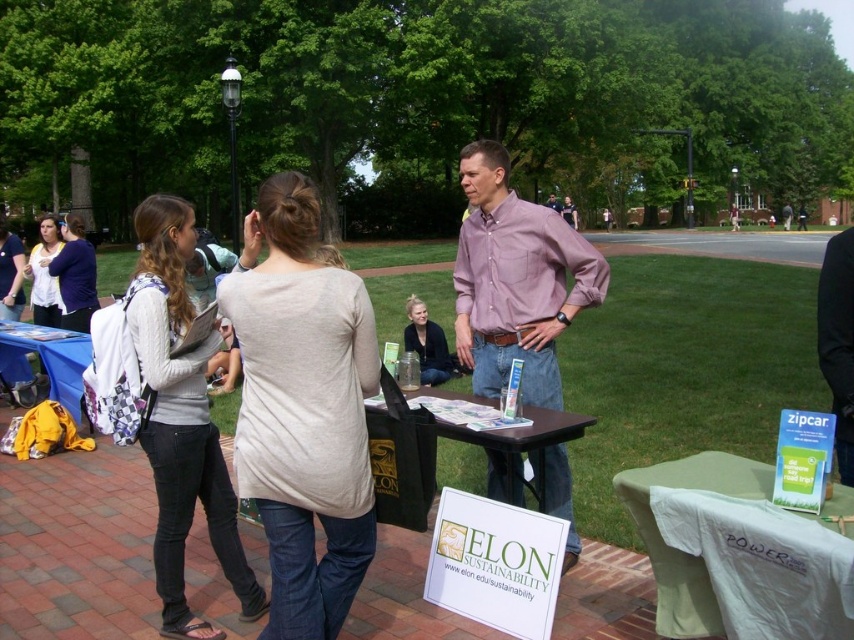
Does beige soft t-shirt at center have a lesser width compared to matte black shirt at center?

Incorrect, beige soft t-shirt at center's width is not less than matte black shirt at center's.

Consider the image. Who is lower down, beige soft t-shirt at center or matte black shirt at center?

matte black shirt at center is lower down.

This screenshot has width=854, height=640. What do you see at coordinates (303, 408) in the screenshot?
I see `beige soft t-shirt at center` at bounding box center [303, 408].

Find the location of `beige soft t-shirt at center`. beige soft t-shirt at center is located at coordinates (303, 408).

Consider the image. Can you confirm if white backpack at left is bigger than black plastic table at center?

No.

Measure the distance between white backpack at left and black plastic table at center.

white backpack at left and black plastic table at center are 4.52 feet apart from each other.

The image size is (854, 640). Find the location of `white backpack at left`. white backpack at left is located at coordinates (180, 420).

Where is `black plastic table at center`? This screenshot has height=640, width=854. black plastic table at center is located at coordinates (524, 444).

Is black plastic table at center wider than matte white shirt at center?

In fact, black plastic table at center might be narrower than matte white shirt at center.

The width and height of the screenshot is (854, 640). In order to click on black plastic table at center in this screenshot , I will do `click(524, 444)`.